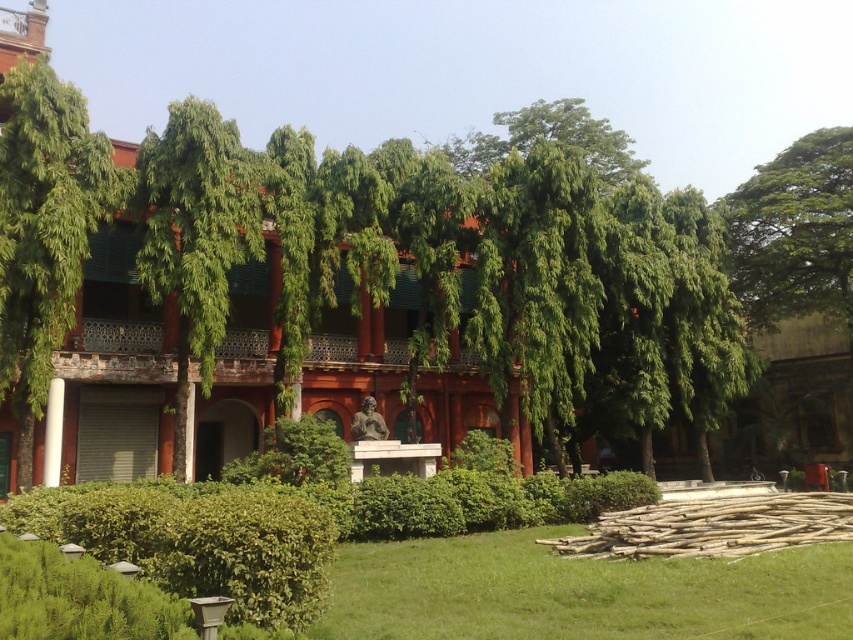
This screenshot has width=853, height=640. Describe the element at coordinates (579, 593) in the screenshot. I see `green grass at lower center` at that location.

Is green grass at lower center bigger than green leafy hedge at lower left?

Actually, green grass at lower center might be smaller than green leafy hedge at lower left.

Who is more distant from viewer, (409, 582) or (247, 504)?

The point (409, 582) is behind.

Image resolution: width=853 pixels, height=640 pixels. Identify the location of green grass at lower center. (579, 593).

Is point (181, 577) behind point (804, 230)?

No, it is not.

At what (x,y) coordinates should I click in order to perform the action: click on green leafy hedge at lower left. Please return your answer as a coordinate pair (x, y). The image size is (853, 640). Looking at the image, I should click on (198, 540).

At what (x,y) coordinates should I click in order to perform the action: click on green leafy hedge at lower left. Please return your answer as a coordinate pair (x, y). This screenshot has width=853, height=640. Looking at the image, I should click on coord(198,540).

From the picture: Is green grass at lower center positioned behind green leafy tree at left?

That is False.

Which is behind, point (837, 554) or point (25, 212)?

Positioned behind is point (25, 212).

At what (x,y) coordinates should I click in order to perform the action: click on green grass at lower center. Please return your answer as a coordinate pair (x, y). Looking at the image, I should click on pos(579,593).